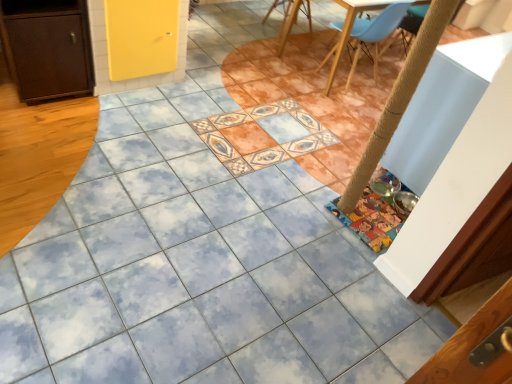
Question: From a real-world perspective, is wooden chair at upper center, which is the first chair from back to front, under light blue plastic chair at upper right, which ranks as the 1th chair in front-to-back order?

Choices:
 (A) yes
 (B) no

Answer: (A)

Question: From the image's perspective, is wooden chair at upper center, which is the first chair from back to front, on top of light blue plastic chair at upper right, the second chair in the left-to-right sequence?

Choices:
 (A) no
 (B) yes

Answer: (B)

Question: Is wooden chair at upper center, which is the first chair from back to front, to the left of light blue plastic chair at upper right, the second chair in the left-to-right sequence, from the viewer's perspective?

Choices:
 (A) no
 (B) yes

Answer: (B)

Question: Is light blue plastic chair at upper right, which ranks as the 1th chair in front-to-back order, located within wooden chair at upper center, the 2th chair positioned from the front?

Choices:
 (A) no
 (B) yes

Answer: (A)

Question: Considering the relative sizes of wooden chair at upper center, which ranks as the 1th chair in left-to-right order, and light blue plastic chair at upper right, which ranks as the 1th chair in front-to-back order, in the image provided, is wooden chair at upper center, which ranks as the 1th chair in left-to-right order, thinner than light blue plastic chair at upper right, which ranks as the 1th chair in front-to-back order,?

Choices:
 (A) no
 (B) yes

Answer: (A)

Question: Does wooden chair at upper center, which ranks as the 1th chair in left-to-right order, have a greater height compared to light blue plastic chair at upper right, which ranks as the 1th chair in front-to-back order?

Choices:
 (A) yes
 (B) no

Answer: (B)

Question: Is light blue plastic chair at upper right, the second chair positioned from the back, smaller than brown matte cabinet at left?

Choices:
 (A) yes
 (B) no

Answer: (B)

Question: Could you tell me if light blue plastic chair at upper right, which ranks as the 1th chair in front-to-back order, is turned towards brown matte cabinet at left?

Choices:
 (A) yes
 (B) no

Answer: (B)

Question: From a real-world perspective, is light blue plastic chair at upper right, the second chair positioned from the back, positioned under brown matte cabinet at left based on gravity?

Choices:
 (A) no
 (B) yes

Answer: (A)

Question: Considering the relative sizes of light blue plastic chair at upper right, which ranks as the 1th chair in front-to-back order, and brown matte cabinet at left in the image provided, is light blue plastic chair at upper right, which ranks as the 1th chair in front-to-back order, thinner than brown matte cabinet at left?

Choices:
 (A) no
 (B) yes

Answer: (A)

Question: Can brown matte cabinet at left be found inside light blue plastic chair at upper right, which is the first chair from right to left?

Choices:
 (A) yes
 (B) no

Answer: (B)

Question: Considering the relative sizes of light blue plastic chair at upper right, the second chair in the left-to-right sequence, and brown matte cabinet at left in the image provided, is light blue plastic chair at upper right, the second chair in the left-to-right sequence, bigger than brown matte cabinet at left?

Choices:
 (A) yes
 (B) no

Answer: (A)

Question: Can you confirm if brown matte cabinet at left is bigger than wooden chair at upper center, which appears as the second chair when viewed from the right?

Choices:
 (A) yes
 (B) no

Answer: (A)